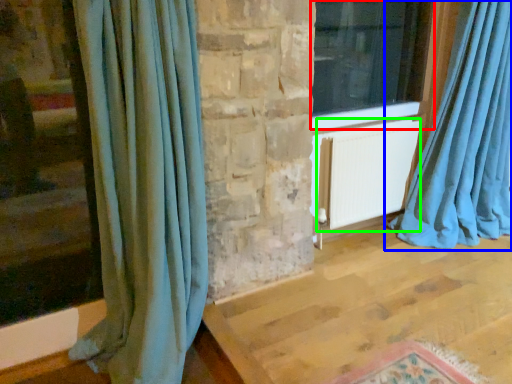
Question: Which object is the farthest from window (highlighted by a red box)? Choose among these: curtain (highlighted by a blue box) or radiator (highlighted by a green box).

Choices:
 (A) curtain
 (B) radiator

Answer: (A)